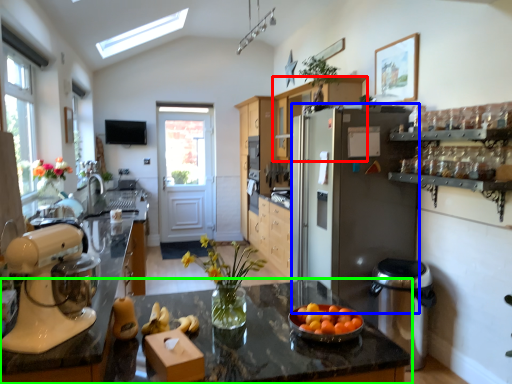
Question: Which is farther away from cabinetry (highlighted by a red box)? refrigerator (highlighted by a blue box) or countertop (highlighted by a green box)?

Choices:
 (A) refrigerator
 (B) countertop

Answer: (B)